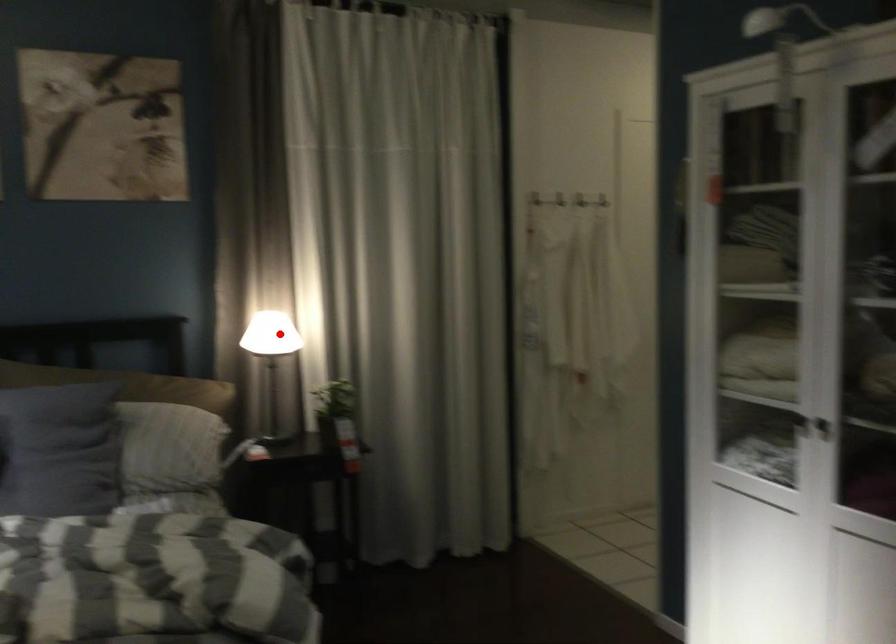
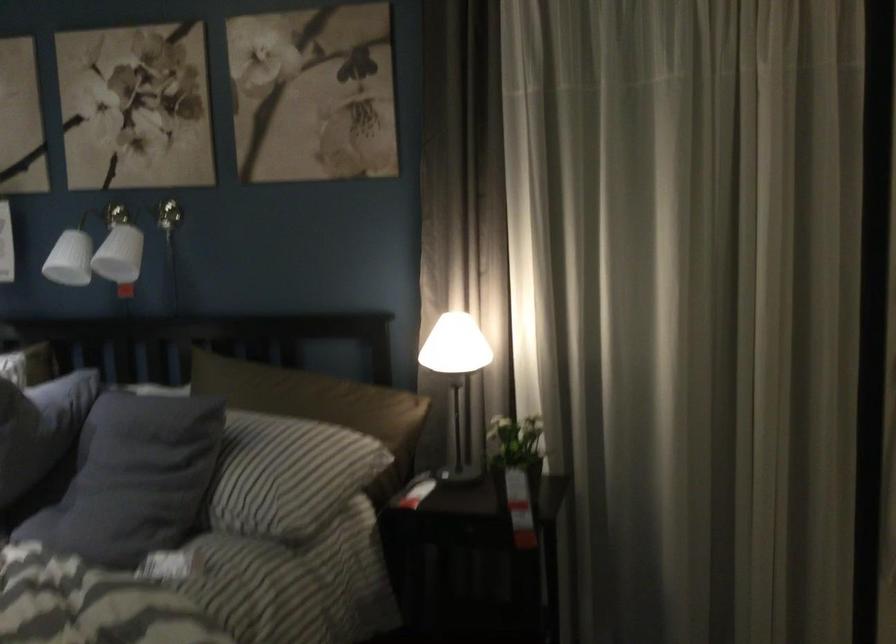
Locate, in the second image, the point that corresponds to the highlighted location in the first image.

(455, 345)